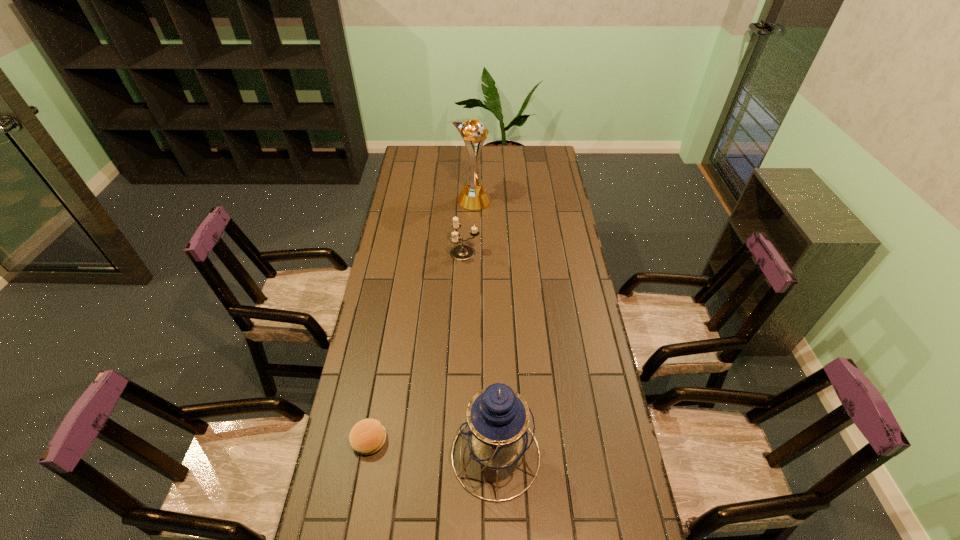
Identify the location of trophy. This screenshot has width=960, height=540. (474, 196).

Locate an element on the screen. This screenshot has height=540, width=960. the second tallest object is located at coordinates click(497, 429).

This screenshot has width=960, height=540. Find the location of `the second farthest object`. the second farthest object is located at coordinates (462, 252).

This screenshot has width=960, height=540. Find the location of `candle holder`. candle holder is located at coordinates [462, 252].

Find the location of a particular element. This screenshot has width=960, height=540. the leftmost object is located at coordinates (368, 436).

The height and width of the screenshot is (540, 960). Find the location of `the shortest object`. the shortest object is located at coordinates (368, 436).

Locate an element on the screen. vacant space located 0.220m on the front-facing side of the farthest object is located at coordinates (538, 201).

The height and width of the screenshot is (540, 960). In order to click on free point located on the front-facing side of the third shortest object in this screenshot , I will do `click(412, 455)`.

Locate an element on the screen. vacant space situated on the front-facing side of the third shortest object is located at coordinates (430, 455).

The image size is (960, 540). In order to click on vacant space located 0.180m on the front-facing side of the third shortest object in this screenshot , I will do click(x=387, y=455).